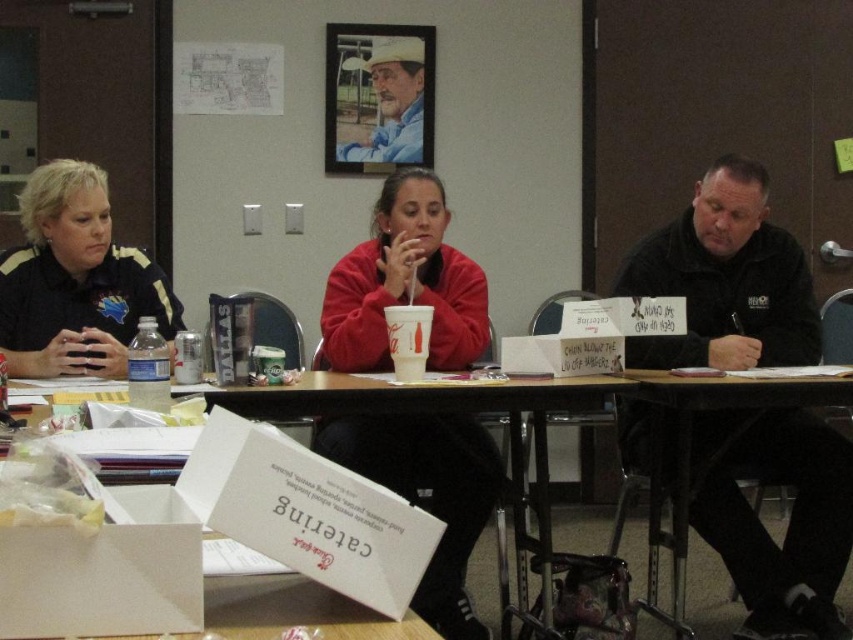
Question: Which point is closer to the camera?

Choices:
 (A) rustic wood frame at upper center
 (B) white cardboard box at lower center
 (C) black jersey at left
 (D) black matte jacket at center

Answer: (B)

Question: Does white cardboard box at lower center appear on the left side of rustic wood frame at upper center?

Choices:
 (A) yes
 (B) no

Answer: (B)

Question: Can you confirm if black matte jacket at center is wider than white cardboard box at lower center?

Choices:
 (A) yes
 (B) no

Answer: (B)

Question: Does matte red sweater at center have a lesser width compared to rustic wood frame at upper center?

Choices:
 (A) yes
 (B) no

Answer: (B)

Question: Which object is positioned farthest from the black matte jacket at center?

Choices:
 (A) white cardboard box at lower center
 (B) matte red sweater at center

Answer: (B)

Question: Which object is the closest to the rustic wood frame at upper center?

Choices:
 (A) black matte jacket at center
 (B) black jersey at left

Answer: (B)